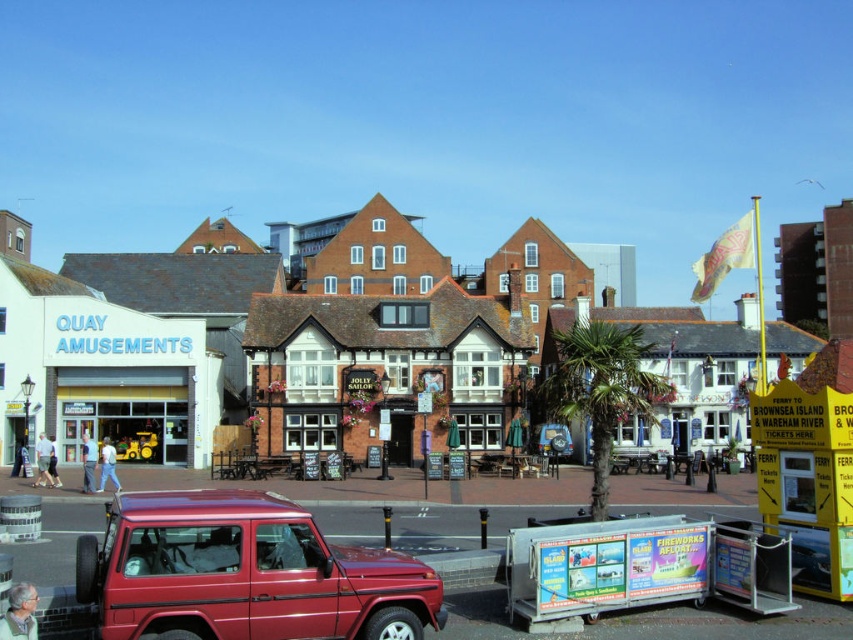
Question: Which object is closer to the camera taking this photo?

Choices:
 (A) shiny red suv at lower left
 (B) white brick building at center

Answer: (A)

Question: Among these points, which one is nearest to the camera?

Choices:
 (A) (97, 582)
 (B) (585, 291)

Answer: (A)

Question: Considering the relative positions of white brick building at center and shiny red suv at lower left in the image provided, where is white brick building at center located with respect to shiny red suv at lower left?

Choices:
 (A) right
 (B) left

Answer: (B)

Question: Does white brick building at center have a smaller size compared to shiny red suv at lower left?

Choices:
 (A) no
 (B) yes

Answer: (A)

Question: Is white brick building at center further to the viewer compared to shiny red suv at lower left?

Choices:
 (A) yes
 (B) no

Answer: (A)